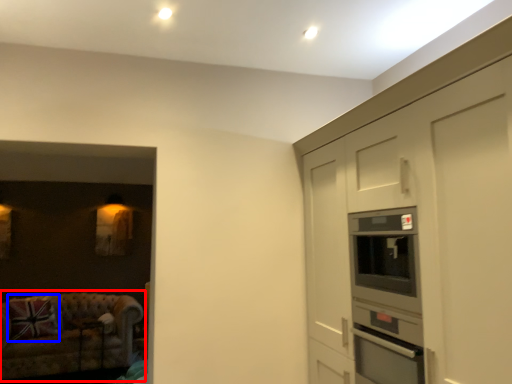
Question: Which object is closer to the camera taking this photo, studio couch (highlighted by a red box) or pillow (highlighted by a blue box)?

Choices:
 (A) studio couch
 (B) pillow

Answer: (A)